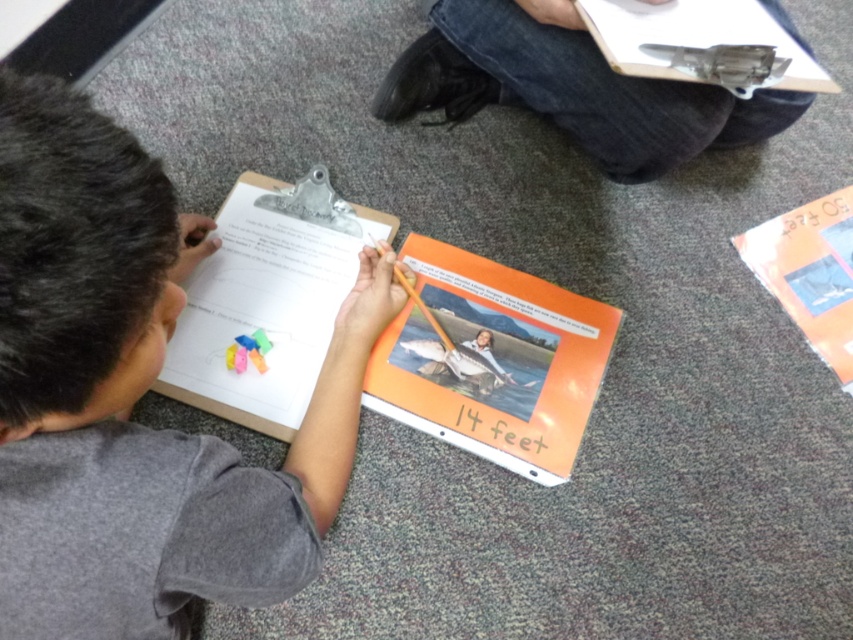
Question: Which of these objects is positioned farthest from the white paper clipboard at center?

Choices:
 (A) orange matte book at center
 (B) gray matte shirt at upper left
 (C) orange paper book at lower right
 (D) metallic gray book at upper center

Answer: (C)

Question: Which point appears closest to the camera in this image?

Choices:
 (A) (502, 291)
 (B) (773, 80)
 (C) (274, 314)
 (D) (503, 435)

Answer: (D)

Question: Does white paper clipboard at center appear over orange paper book at lower right?

Choices:
 (A) no
 (B) yes

Answer: (A)

Question: Does orange matte book at center appear under metallic gray book at upper center?

Choices:
 (A) yes
 (B) no

Answer: (A)

Question: Which point appears farthest from the camera in this image?

Choices:
 (A) (816, 241)
 (B) (756, 16)
 (C) (260, 387)

Answer: (A)

Question: Is gray matte shirt at upper left to the right of orange matte book at center from the viewer's perspective?

Choices:
 (A) yes
 (B) no

Answer: (B)